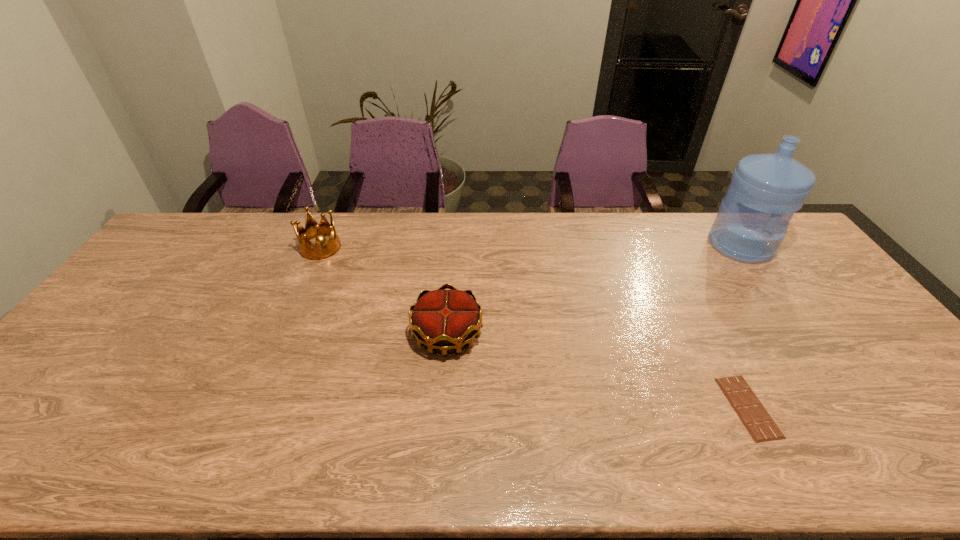
I want to click on free space at the right edge of the desktop, so click(x=881, y=418).

The height and width of the screenshot is (540, 960). Find the location of `free space at the far left corner`. free space at the far left corner is located at coordinates (195, 231).

In order to click on free space between the leftmost object and the tallest object in this screenshot , I will do `click(531, 246)`.

At what (x,y) coordinates should I click in order to perform the action: click on free space between the nearest object and the leftmost object. Please return your answer as a coordinate pair (x, y). This screenshot has width=960, height=540. Looking at the image, I should click on [535, 327].

Identify the location of empty location between the right crown and the farther crown. This screenshot has height=540, width=960. (384, 291).

Find the location of a particular element. vacant space in between the tallest object and the shortest object is located at coordinates (744, 326).

Where is `empty space between the leftmost object and the second object from right to left`? This screenshot has height=540, width=960. empty space between the leftmost object and the second object from right to left is located at coordinates [535, 327].

You are a GUI agent. You are given a task and a screenshot of the screen. Output one action in this format:
    pyautogui.click(x=<x>, y=<y>)
    Task: Click on the vacant area that lies between the third object from left to right and the taller crown
    
    Given the screenshot: What is the action you would take?
    [535, 327]

Image resolution: width=960 pixels, height=540 pixels. Identify the location of free space between the chocolate bar and the shorter crown. (598, 371).

Identify the location of empty space that is in between the nearest object and the rightmost object. This screenshot has height=540, width=960. (744, 326).